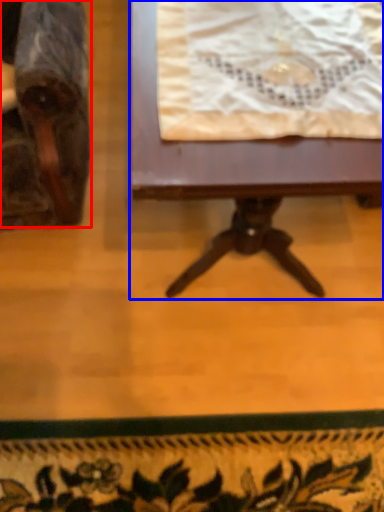
Question: Which object appears farthest to the camera in this image, chair (highlighted by a red box) or table (highlighted by a blue box)?

Choices:
 (A) chair
 (B) table

Answer: (B)